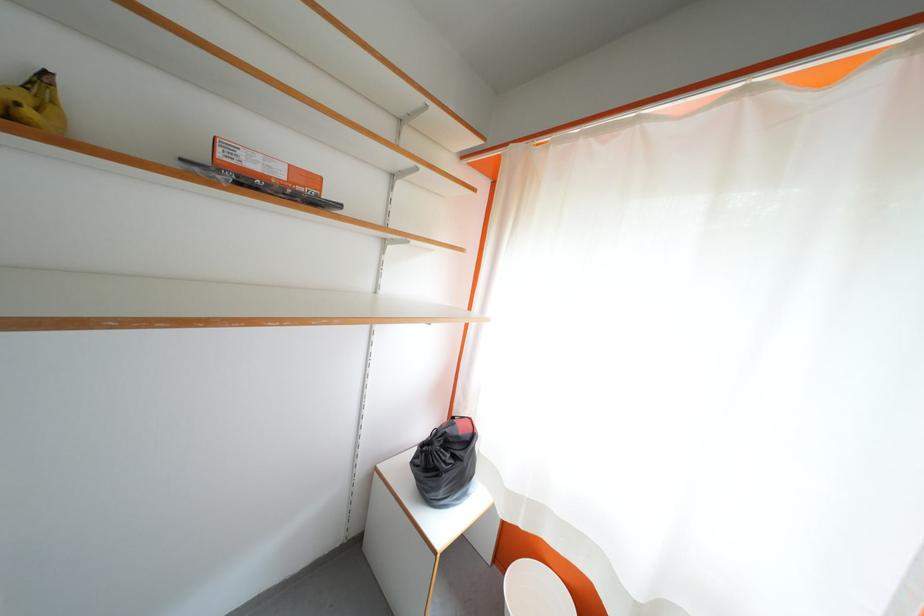
Find where to pull the bag drawstring. Please return your answer as a coordinate pair (x, y).

(440, 451)